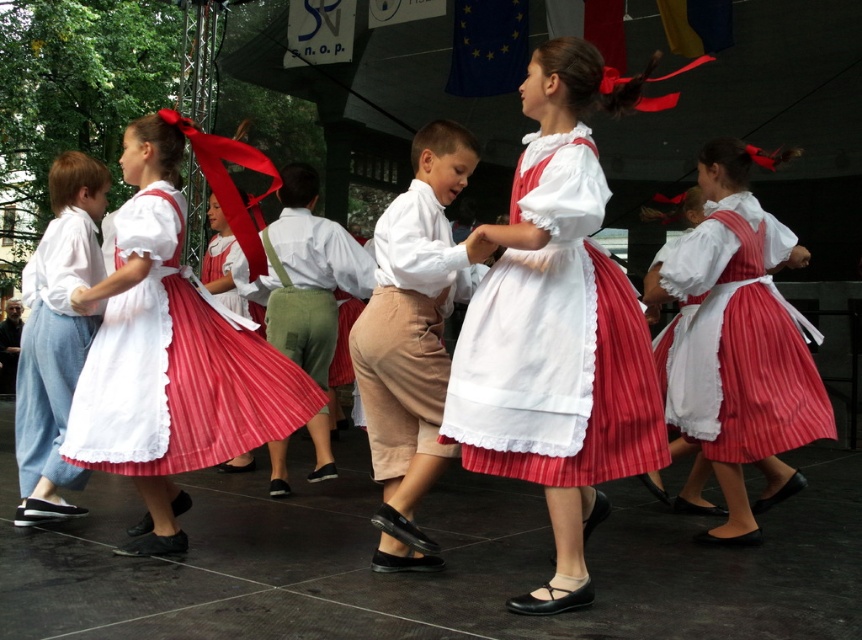
You are a photographer trying to capture the dance performance. You notice the tan cotton skirt at center and the matte white skirt at left. Which skirt is positioned higher in the image?

The tan cotton skirt at center is positioned higher than the matte white skirt at left.